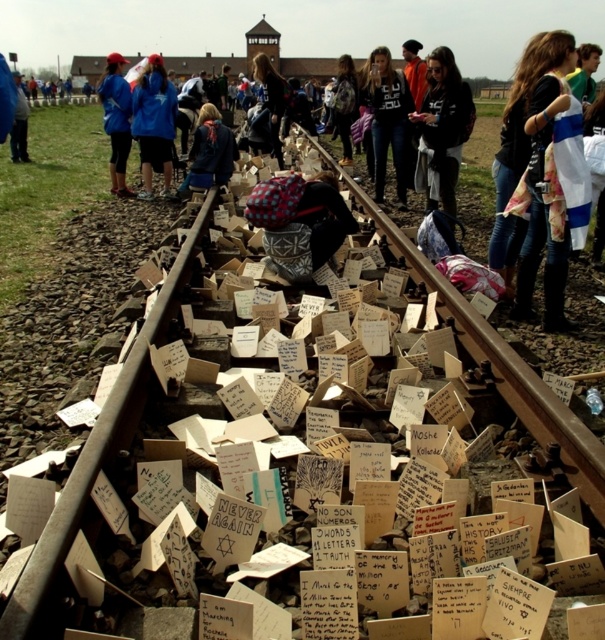
You are a photographer at the memorial site and want to capture both the denim jacket at center and the dark brown leather jacket at center in a single frame. Given their sizes, which jacket will appear larger in the photo?

The dark brown leather jacket at center will appear larger in the photo since it has a bigger size than the denim jacket at center.

You are a tour guide leading a group at the memorial site. You notice a blue fleece jacket at center and a dark brown leather jacket at center. Your group wants to know if they can safely walk between these two jackets without stepping on the memorial signs. The path between them is 8.09 feet wide. If an average person needs 2 feet of space to walk comfortably, can they pass through comfortably?

The distance between the blue fleece jacket at center and the dark brown leather jacket at center is 8.09 feet. Since an average person requires 2 feet of space to walk comfortably, the 8.09 feet width provides ample room for safe and comfortable passage between the two jackets.